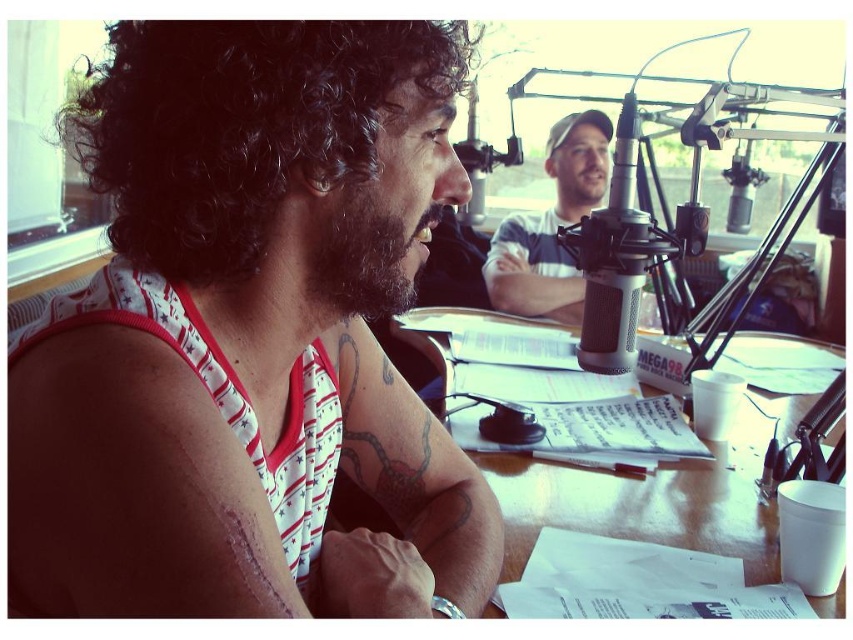
You are a fashion designer observing a radio studio scene. You notice two items with white stripes. The first is the white striped tank top at left and the second is the white striped shirt at center. Which of these two items is located more to the left in the image?

The white striped tank top at left is positioned on the left side of the white striped shirt at center, so the white striped tank top at left is more to the left.

You are designing a layout for a new radio studio and need to place two items in the scene. The scar tissue at upper left and the wooden table at center must be included. Based on their sizes, which object should be placed closer to the entrance to ensure there is enough space for movement?

The scar tissue at upper left occupies less space than the wooden table at center, so placing the scar tissue at upper left closer to the entrance would leave more space for movement around the larger wooden table at center.